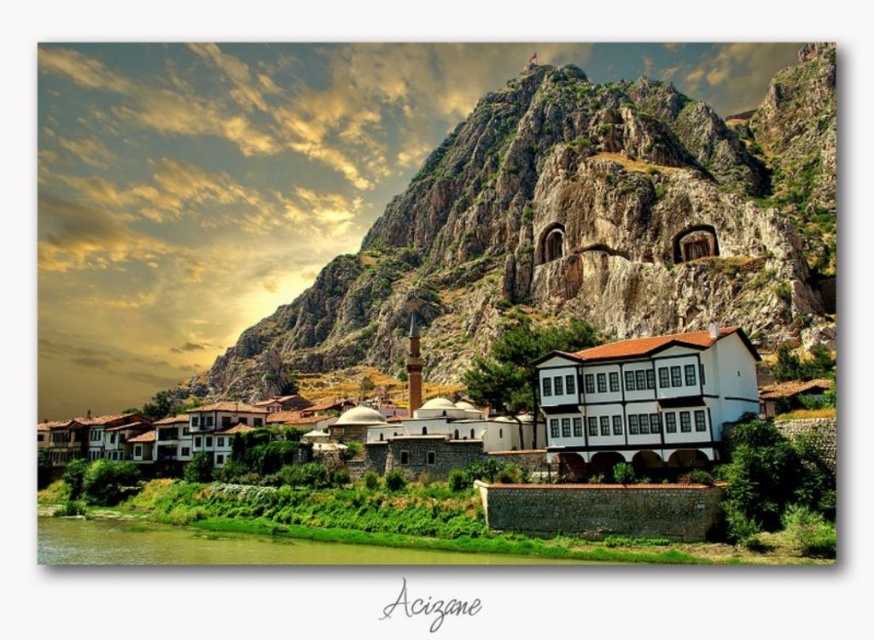
You are standing at the edge of the water and looking towards the town. Which object is higher in your field of view, the rugged stone mountain at upper center or the white stone building at center?

The rugged stone mountain at upper center is higher in your field of view than the white stone building at center because it is positioned above it.

You are standing in the town square and want to take a photo of both the rugged stone mountain at upper center and the white stone building at center. Which object should you adjust your camera focus on first to ensure both are in the frame?

Since the rugged stone mountain at upper center is further away than the white stone building at center, you should focus on the mountain first to ensure both are in the frame.